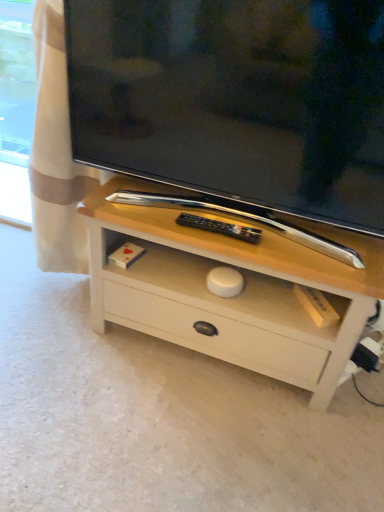
Identify the location of free point below matte black tv at center (from a real-world perspective). The image size is (384, 512). (236, 223).